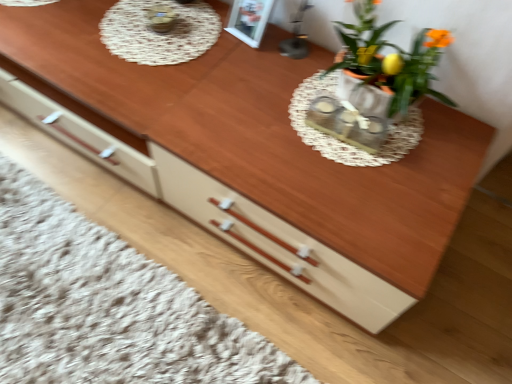
The width and height of the screenshot is (512, 384). In order to click on free point above white lace doily at upper center (from a real-world perspective) in this screenshot , I will do [x=159, y=29].